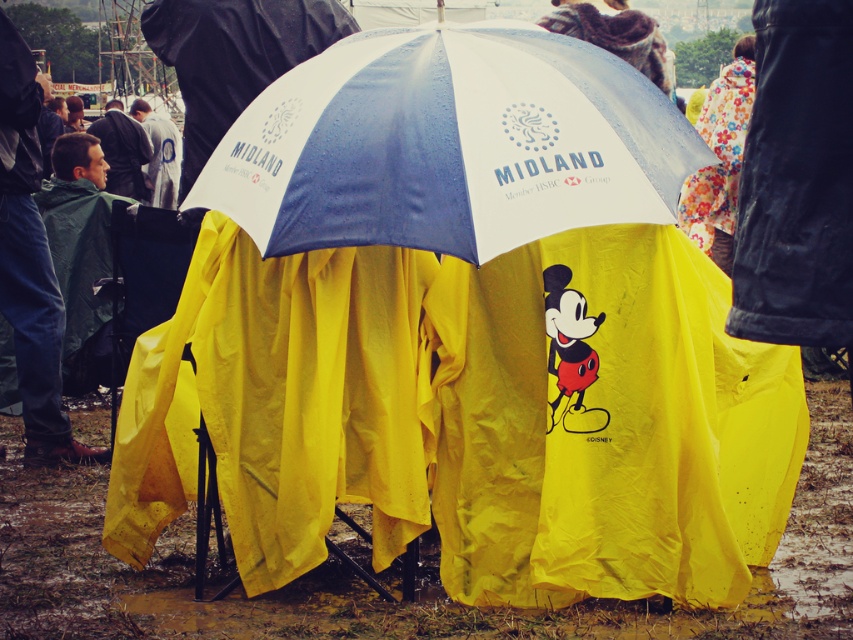
Between whiteumbrella at center and green waterproof jacket at lower left, which one appears on the right side from the viewer's perspective?

From the viewer's perspective, whiteumbrella at center appears more on the right side.

Who is more distant from viewer, [332,160] or [25,294]?

Positioned behind is point [25,294].

The width and height of the screenshot is (853, 640). What do you see at coordinates (450, 145) in the screenshot?
I see `whiteumbrella at center` at bounding box center [450, 145].

The height and width of the screenshot is (640, 853). I want to click on whiteumbrella at center, so click(450, 145).